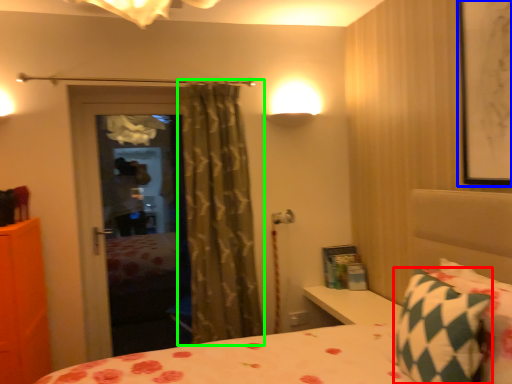
Question: Which object is the farthest from pillow (highlighted by a red box)? Choose among these: picture frame (highlighted by a blue box) or curtain (highlighted by a green box).

Choices:
 (A) picture frame
 (B) curtain

Answer: (B)